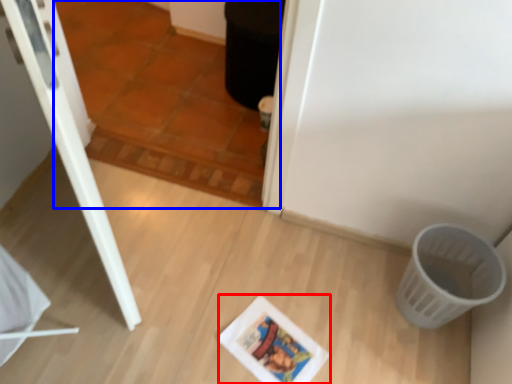
Question: Among these objects, which one is nearest to the camera, comic book (highlighted by a red box) or tile (highlighted by a blue box)?

Choices:
 (A) comic book
 (B) tile

Answer: (B)